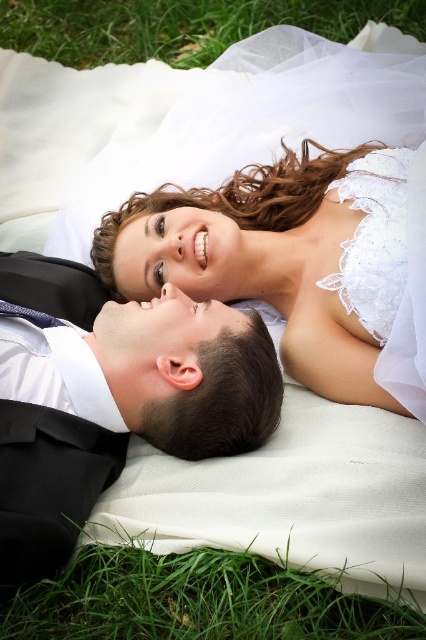
You are a photographer at a wedding and see the white lace dress at upper center and the lace white dress at upper center in the scene. Which one is closer to you?

The white lace dress at upper center is closer to you than the lace white dress at upper center.

You are standing at the point labeled point (31, 32) and want to walk to the point labeled point (382, 259). Which direction should you move in to reach your destination?

To reach point (382, 259) from point (31, 32), you should move forward since point (382, 259) is in front of point (31, 32).

You are a photographer at a wedding and need to capture a closeup of the white lace dress at upper center and the lace white dress at upper center. Which dress should you focus on if you want to capture the one that is taller?

The white lace dress at upper center is taller than the lace white dress at upper center, so you should focus on the white lace dress at upper center to capture the taller one.